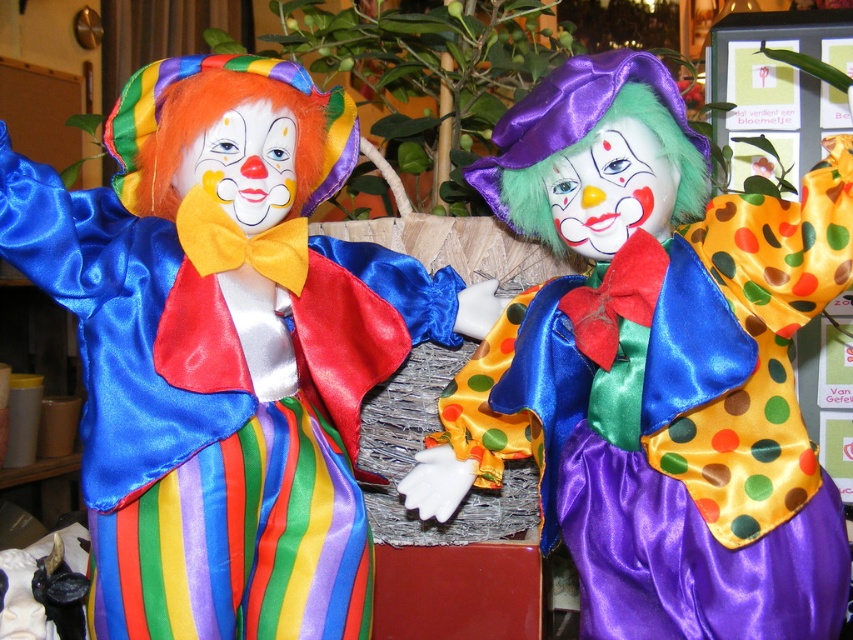
You are a toy store employee who needs to place the satin clown at left and the polka dot satin clown at center into a display case that can only accommodate one of them. Based on their sizes, which clown should you choose to fit in the display case?

The satin clown at left has a larger size compared to the polka dot satin clown at center, so you should choose the polka dot satin clown at center to fit in the display case since it is smaller.

You are a toy store employee who needs to place a new 10 inch tall box on the shelf between the satin clown at left and the polka dot satin clown at center. Is there enough space for the box between them?

The satin clown at left is 8.94 inches from the polka dot satin clown at center. Since the box is 10 inches tall, the space between them is insufficient as 8.94 inches is less than 10 inches. The box won t fit vertically between them.